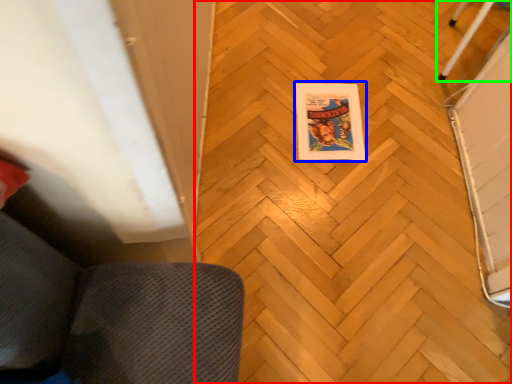
Question: Which is farther away from plywood (highlighted by a red box)? comic book (highlighted by a blue box) or furniture (highlighted by a green box)?

Choices:
 (A) comic book
 (B) furniture

Answer: (B)